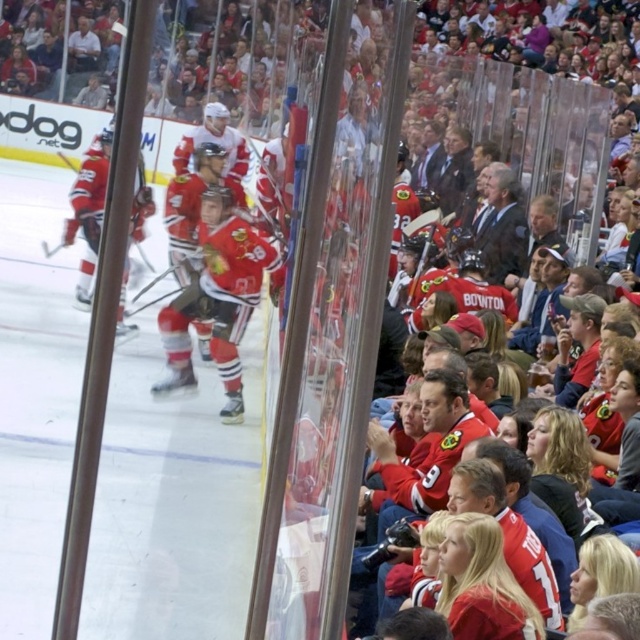
Question: Is matte jersey at center behind red jersey at left?

Choices:
 (A) no
 (B) yes

Answer: (B)

Question: Which point is closer to the camera?

Choices:
 (A) red jersey at left
 (B) red jersey hockey player at center
 (C) red jersey hockey at center
 (D) matte jersey at center

Answer: (A)

Question: Which point is closer to the camera?

Choices:
 (A) red jersey at left
 (B) red jersey hockey at center
 (C) matte jersey at center
 (D) red jersey hockey player at center

Answer: (A)

Question: Does red jersey hockey player at center have a lesser width compared to matte jersey at center?

Choices:
 (A) yes
 (B) no

Answer: (A)

Question: Among these points, which one is nearest to the camera?

Choices:
 (A) (250, 272)
 (B) (93, 177)
 (C) (209, 275)

Answer: (B)

Question: Can you confirm if red jersey hockey player at center is positioned above red jersey hockey at center?

Choices:
 (A) yes
 (B) no

Answer: (A)